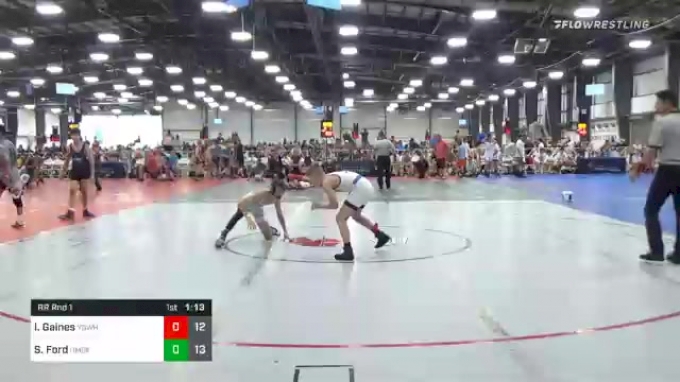
At what (x,y) coordinates should I click in order to perform the action: click on mat. Please return your answer as a coordinate pair (x, y). The width and height of the screenshot is (680, 382). Looking at the image, I should click on click(x=357, y=269).